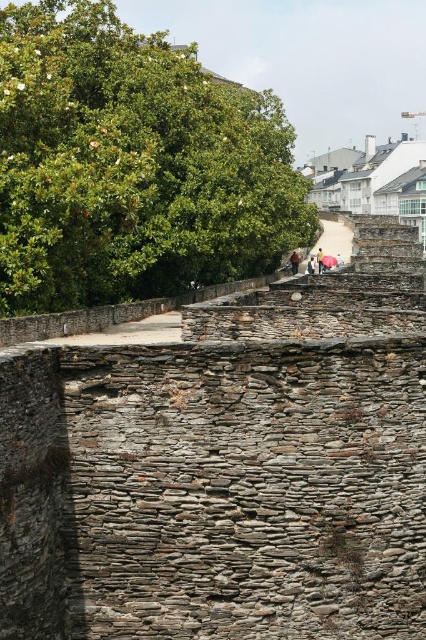
You are standing at the historical stone structure and want to take a photo of the modern buildings in the background. To ensure both the historical wall and the modern buildings are in focus, where should you position yourself relative to the two points marked as point [296,257] and point [340,260]?

You should position yourself between point [296,257] and point [340,260], closer to point [296,257] since it is in front of point [340,260]. This placement will help keep both the historical wall and the modern buildings in focus by utilizing the depth of field effectively.

From the picture: You are standing at the base of the ancient stone wall and see the brown leather jacket at center and the light brown fabric umbrella at upper center. Which object is closer to you?

The brown leather jacket at center is closer to you because the light brown fabric umbrella at upper center is behind it.